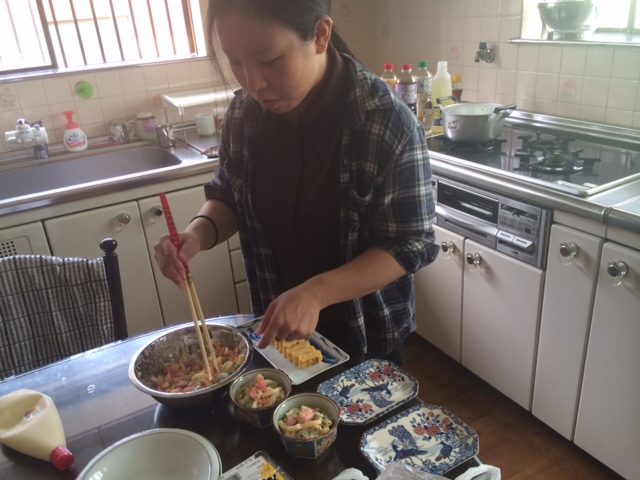
Identify the location of chop sticks. (192, 283), (188, 292).